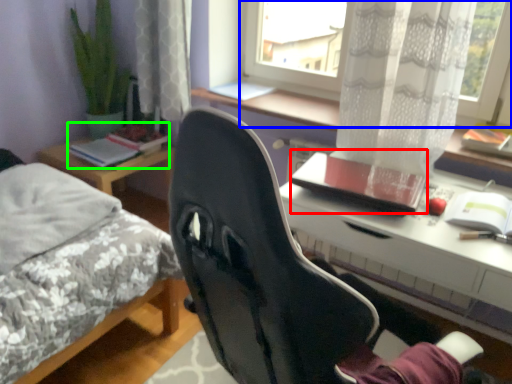
Question: Which object is positioned farthest from notebook (highlighted by a red box)? Select from window (highlighted by a blue box) and book (highlighted by a green box).

Choices:
 (A) window
 (B) book

Answer: (B)